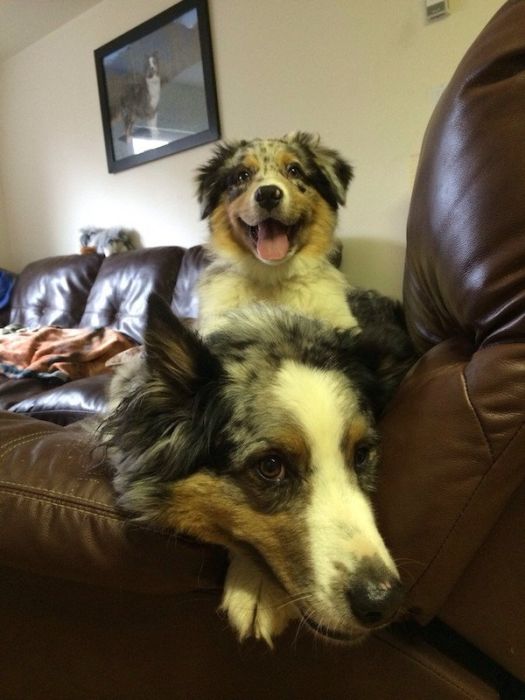
Find the location of a particular element. picture is located at coordinates (178, 99).